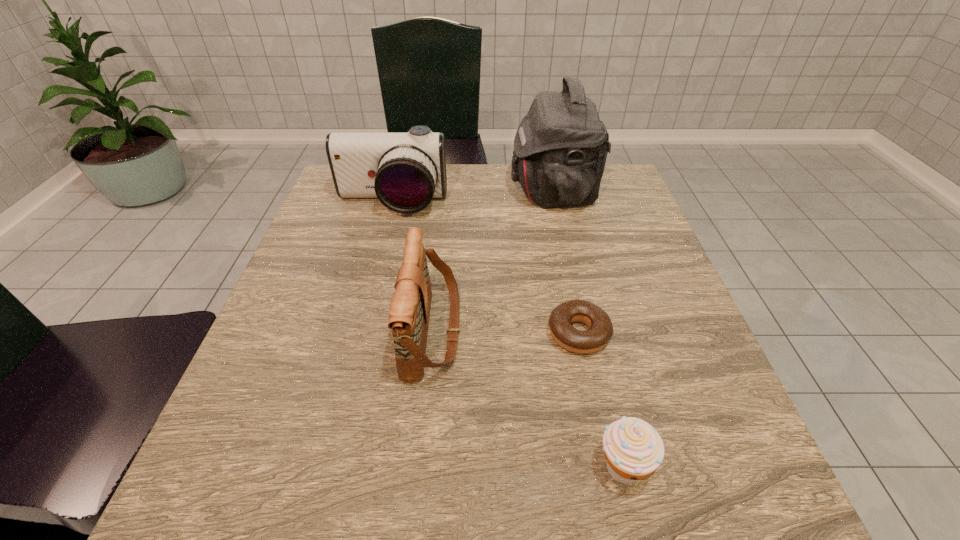
Where is `the farther shoulder bag`? This screenshot has height=540, width=960. the farther shoulder bag is located at coordinates (560, 148).

Where is `the right shoulder bag`? This screenshot has height=540, width=960. the right shoulder bag is located at coordinates (560, 148).

The height and width of the screenshot is (540, 960). Identify the location of camcorder. (404, 171).

In order to click on the left shoulder bag in this screenshot , I will do `click(409, 313)`.

At what (x,y) coordinates should I click in order to perform the action: click on the nearer shoulder bag. Please return your answer as a coordinate pair (x, y). The width and height of the screenshot is (960, 540). Looking at the image, I should click on pos(409,313).

Where is `muffin`? Image resolution: width=960 pixels, height=540 pixels. muffin is located at coordinates (633, 449).

I want to click on the nearest object, so point(633,449).

Find the location of `the shortest object`. the shortest object is located at coordinates (600, 331).

I want to click on free space located on the open flap of the right shoulder bag, so click(372, 191).

This screenshot has height=540, width=960. I want to click on free region located 0.270m on the open flap of the right shoulder bag, so click(x=409, y=191).